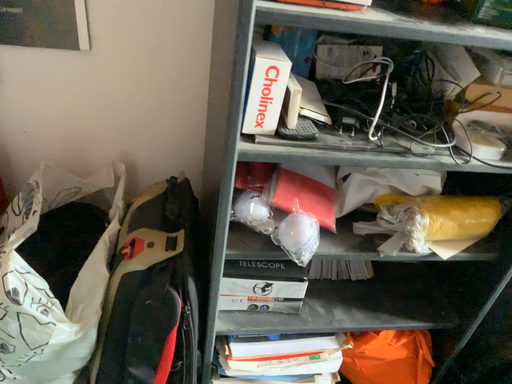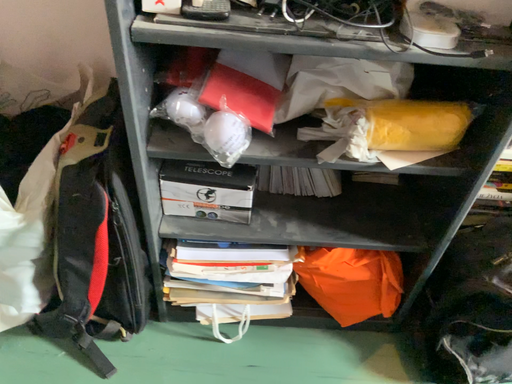
Question: Which way did the camera rotate in the video?

Choices:
 (A) rotated downward
 (B) rotated upward

Answer: (A)